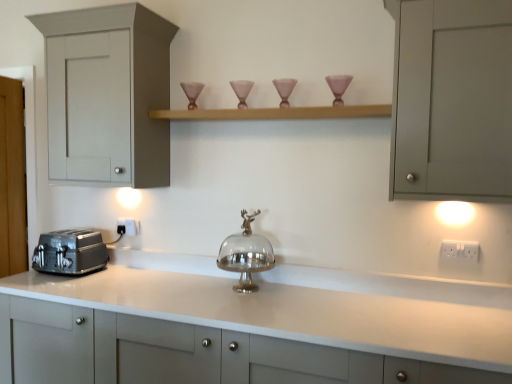
The height and width of the screenshot is (384, 512). What do you see at coordinates (246, 254) in the screenshot? I see `silver metallic cake stand at center` at bounding box center [246, 254].

In order to face white plastic electric outlet at right, which is counted as the second electric outlet, starting from the left, should I rotate leftwards or rightwards?

A 25.575 degree turn to the right will do.

Describe the element at coordinates (128, 226) in the screenshot. Image resolution: width=512 pixels, height=384 pixels. I see `white plastic electric outlet at lower center, acting as the first electric outlet starting from the back` at that location.

Where is `white plastic electric outlet at lower center, which is the second electric outlet in front-to-back order`? This screenshot has width=512, height=384. white plastic electric outlet at lower center, which is the second electric outlet in front-to-back order is located at coordinates (128, 226).

The width and height of the screenshot is (512, 384). What are the coordinates of `wooden shelf at upper center` in the screenshot? It's located at (275, 113).

In the scene shown: Measure the distance between point (339, 79) and camera.

2.00 meters.

The width and height of the screenshot is (512, 384). In order to click on silver metallic cake stand at center in this screenshot , I will do `click(246, 254)`.

Who is smaller, wooden shelf at upper center or white plastic electric outlet at lower center, positioned as the second electric outlet in right-to-left order?

white plastic electric outlet at lower center, positioned as the second electric outlet in right-to-left order, is smaller.

Consider the image. Is wooden shelf at upper center facing away from white plastic electric outlet at lower center, positioned as the second electric outlet in right-to-left order?

No, wooden shelf at upper center's orientation is not away from white plastic electric outlet at lower center, positioned as the second electric outlet in right-to-left order.

From the image's perspective, who appears lower, wooden shelf at upper center or white plastic electric outlet at lower center, which is the second electric outlet in front-to-back order?

white plastic electric outlet at lower center, which is the second electric outlet in front-to-back order, from the image's perspective.

Between wooden shelf at upper center and white plastic electric outlet at right, marked as the 1th electric outlet in a right-to-left arrangement, which one has larger width?

wooden shelf at upper center.

Is wooden shelf at upper center aimed at white plastic electric outlet at right, which is the 1th electric outlet in front-to-back order?

No.

Is point (213, 113) positioned after point (452, 256)?

Yes.

Is wooden shelf at upper center far away from white plastic electric outlet at right, which is the 1th electric outlet in front-to-back order?

That's not correct — wooden shelf at upper center is a little close to white plastic electric outlet at right, which is the 1th electric outlet in front-to-back order.

From the image's perspective, would you say white plastic electric outlet at lower center, which is counted as the 1th electric outlet, starting from the left, is shown under white glossy countertop at center, which is counted as the third cabinetry, starting from the top?

No, from the image's perspective, white plastic electric outlet at lower center, which is counted as the 1th electric outlet, starting from the left, is not below white glossy countertop at center, which is counted as the third cabinetry, starting from the top.

In the scene shown: Do you think white plastic electric outlet at lower center, positioned as the second electric outlet in right-to-left order, is within white glossy countertop at center, the 1th cabinetry from the bottom, or outside of it?

white plastic electric outlet at lower center, positioned as the second electric outlet in right-to-left order, is outside white glossy countertop at center, the 1th cabinetry from the bottom.

In the scene shown: Does white plastic electric outlet at lower center, which is the second electric outlet in front-to-back order, lie in front of white glossy countertop at center, the 1th cabinetry from the bottom?

No, white plastic electric outlet at lower center, which is the second electric outlet in front-to-back order, is further to the viewer.

Could you measure the distance between white plastic electric outlet at lower center, which is the second electric outlet in front-to-back order, and white glossy countertop at center, which is counted as the third cabinetry, starting from the top?

They are 35.63 inches apart.

How different are the orientations of satin silver toaster at lower left and white plastic electric outlet at lower center, which is the second electric outlet in front-to-back order, in degrees?

0.00394 degrees.

From a real-world perspective, is satin silver toaster at lower left on top of white plastic electric outlet at lower center, which is the second electric outlet in front-to-back order?

Actually, satin silver toaster at lower left is physically below white plastic electric outlet at lower center, which is the second electric outlet in front-to-back order, in the real world.

Is satin silver toaster at lower left turned away from white plastic electric outlet at lower center, positioned as the second electric outlet in right-to-left order?

Yes, satin silver toaster at lower left is facing away from white plastic electric outlet at lower center, positioned as the second electric outlet in right-to-left order.

Considering the positions of objects satin silver toaster at lower left and white plastic electric outlet at lower center, which is counted as the 1th electric outlet, starting from the left, in the image provided, who is more to the right, satin silver toaster at lower left or white plastic electric outlet at lower center, which is counted as the 1th electric outlet, starting from the left,?

From the viewer's perspective, white plastic electric outlet at lower center, which is counted as the 1th electric outlet, starting from the left, appears more on the right side.

Is the position of matte gray cabinet at left, which is the third cabinetry from bottom to top, less distant than that of silver metallic cake stand at center?

No, matte gray cabinet at left, which is the third cabinetry from bottom to top, is further to the viewer.

Is matte gray cabinet at left, the first cabinetry in the top-to-bottom sequence, shorter than silver metallic cake stand at center?

In fact, matte gray cabinet at left, the first cabinetry in the top-to-bottom sequence, may be taller than silver metallic cake stand at center.

What are the coordinates of `appliance below the matte gray cabinet at left, which is the third cabinetry from bottom to top (from the image's perspective)` in the screenshot? It's located at (246, 254).

From the image's perspective, which object appears higher, matte gray cabinet at left, which is the third cabinetry from bottom to top, or silver metallic cake stand at center?

matte gray cabinet at left, which is the third cabinetry from bottom to top, is shown above in the image.

Consider the image. Is matte gray cabinet at left, which is the third cabinetry from bottom to top, taller or shorter than matte gray cabinet at upper right, which is counted as the second cabinetry, starting from the top?

matte gray cabinet at left, which is the third cabinetry from bottom to top, is taller than matte gray cabinet at upper right, which is counted as the second cabinetry, starting from the top.

From the image's perspective, would you say matte gray cabinet at left, the first cabinetry in the top-to-bottom sequence, is positioned over matte gray cabinet at upper right, which is the 2th cabinetry in bottom-to-top order?

Correct, matte gray cabinet at left, the first cabinetry in the top-to-bottom sequence, appears higher than matte gray cabinet at upper right, which is the 2th cabinetry in bottom-to-top order, in the image.

Consider the image. Which is closer, (138, 145) or (412, 123)?

The point (412, 123) is more forward.

Locate an element on the screen. Image resolution: width=512 pixels, height=384 pixels. the 1st cabinetry below the matte gray cabinet at left, the first cabinetry in the top-to-bottom sequence (from a real-world perspective) is located at coordinates (453, 100).

Considering the relative sizes of matte gray cabinet at left, which is the third cabinetry from bottom to top, and wooden shelf at upper center in the image provided, is matte gray cabinet at left, which is the third cabinetry from bottom to top, thinner than wooden shelf at upper center?

No.

Is the depth of matte gray cabinet at left, the first cabinetry in the top-to-bottom sequence, greater than that of wooden shelf at upper center?

That is True.

Can you confirm if matte gray cabinet at left, the first cabinetry in the top-to-bottom sequence, is smaller than wooden shelf at upper center?

Incorrect, matte gray cabinet at left, the first cabinetry in the top-to-bottom sequence, is not smaller in size than wooden shelf at upper center.

This screenshot has height=384, width=512. Find the location of `shelf that appears above the white plastic electric outlet at lower center, acting as the first electric outlet starting from the back (from the image's perspective)`. shelf that appears above the white plastic electric outlet at lower center, acting as the first electric outlet starting from the back (from the image's perspective) is located at coordinates (275, 113).

This screenshot has width=512, height=384. In order to click on the 1st electric outlet behind when counting from the wooden shelf at upper center in this screenshot , I will do `click(459, 251)`.

Estimate the real-world distances between objects in this image. Which object is closer to white glossy countertop at center, the 1th cabinetry from the bottom, silver metallic cake stand at center or wooden shelf at upper center?

Among the two, silver metallic cake stand at center is located nearer to white glossy countertop at center, the 1th cabinetry from the bottom.

Considering their positions, is white glossy countertop at center, which is counted as the third cabinetry, starting from the top, positioned closer to matte gray cabinet at left, which is the third cabinetry from bottom to top, than white plastic electric outlet at right, which is the 1th electric outlet in front-to-back order?

white glossy countertop at center, which is counted as the third cabinetry, starting from the top.

From the image, which object appears to be farther from white plastic electric outlet at lower center, acting as the first electric outlet starting from the back, satin silver toaster at lower left or matte gray cabinet at left, which is the third cabinetry from bottom to top?

matte gray cabinet at left, which is the third cabinetry from bottom to top.

Based on their spatial positions, is satin silver toaster at lower left or matte gray cabinet at upper right, which is counted as the second cabinetry, starting from the top, further from white plastic electric outlet at right, which is the 1th electric outlet in front-to-back order?

Among the two, satin silver toaster at lower left is located further to white plastic electric outlet at right, which is the 1th electric outlet in front-to-back order.

When comparing their distances from wooden shelf at upper center, does matte gray cabinet at left, the first cabinetry in the top-to-bottom sequence, or white plastic electric outlet at right, marked as the 1th electric outlet in a right-to-left arrangement, seem closer?

matte gray cabinet at left, the first cabinetry in the top-to-bottom sequence.

When comparing their distances from matte pink glass candle holder at upper right, does matte gray cabinet at left, the first cabinetry in the top-to-bottom sequence, or wooden shelf at upper center seem further?

matte gray cabinet at left, the first cabinetry in the top-to-bottom sequence.

Estimate the real-world distances between objects in this image. Which object is closer to white plastic electric outlet at right, marked as the 1th electric outlet in a right-to-left arrangement, white plastic electric outlet at lower center, acting as the first electric outlet starting from the back, or wooden shelf at upper center?

wooden shelf at upper center lies closer to white plastic electric outlet at right, marked as the 1th electric outlet in a right-to-left arrangement, than the other object.

Considering their positions, is matte gray cabinet at upper right, which is counted as the second cabinetry, starting from the top, positioned closer to white plastic electric outlet at right, marked as the 1th electric outlet in a right-to-left arrangement, than satin silver toaster at lower left?

Among the two, matte gray cabinet at upper right, which is counted as the second cabinetry, starting from the top, is located nearer to white plastic electric outlet at right, marked as the 1th electric outlet in a right-to-left arrangement.

At what (x,y) coordinates should I click in order to perform the action: click on shelf situated between white plastic electric outlet at lower center, positioned as the second electric outlet in right-to-left order, and matte pink glass candle holder at upper right from left to right. Please return your answer as a coordinate pair (x, y). This screenshot has height=384, width=512. Looking at the image, I should click on (275, 113).

Identify the location of shelf between white plastic electric outlet at lower center, positioned as the second electric outlet in right-to-left order, and white plastic electric outlet at right, which is counted as the second electric outlet, starting from the left, from left to right. This screenshot has width=512, height=384. (275, 113).

The height and width of the screenshot is (384, 512). I want to click on shelf between matte gray cabinet at left, the first cabinetry in the top-to-bottom sequence, and white plastic electric outlet at right, the 2th electric outlet when ordered from back to front, from left to right, so click(275, 113).

Locate an element on the screen. The height and width of the screenshot is (384, 512). shelf between matte gray cabinet at left, which is the third cabinetry from bottom to top, and white glossy countertop at center, the 1th cabinetry from the bottom, in the up-down direction is located at coordinates (275, 113).